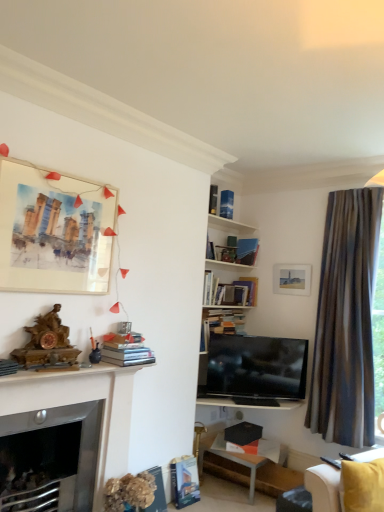
Identify the location of vacant area that lies to the right of hardcover book at lower center, acting as the seventh book starting from the top. The height and width of the screenshot is (512, 384). (203, 506).